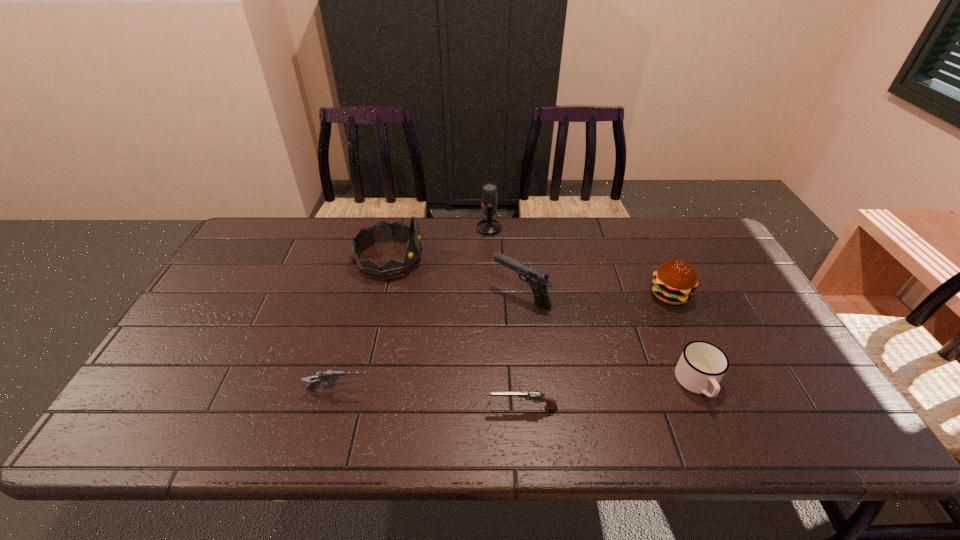
Where is `vacant area situated on the side of the microphone with the red ring`? vacant area situated on the side of the microphone with the red ring is located at coordinates (443, 228).

Find the location of `free location located 0.070m at the front of the tiara with jewels`. free location located 0.070m at the front of the tiara with jewels is located at coordinates [445, 259].

Find the location of a particular element. The height and width of the screenshot is (540, 960). free space located at the muzzle of the farthest gun is located at coordinates (455, 295).

Identify the location of vacant space located at the muzzle of the farthest gun. The image size is (960, 540). (367, 295).

Where is `vacant space located at the muzzle of the farthest gun`? vacant space located at the muzzle of the farthest gun is located at coordinates (394, 295).

Locate an element on the screen. The width and height of the screenshot is (960, 540). free space located on the front of the hamburger is located at coordinates (698, 355).

This screenshot has width=960, height=540. I want to click on vacant space located 0.060m on the side of the mug with the handle, so click(x=718, y=432).

Locate an element on the screen. free spot located at the barrel of the second farthest gun is located at coordinates (443, 392).

I want to click on free space located 0.190m aiming along the barrel of the shortest object, so 406,409.

I want to click on vacant area situated 0.090m aiming along the barrel of the shortest object, so click(449, 409).